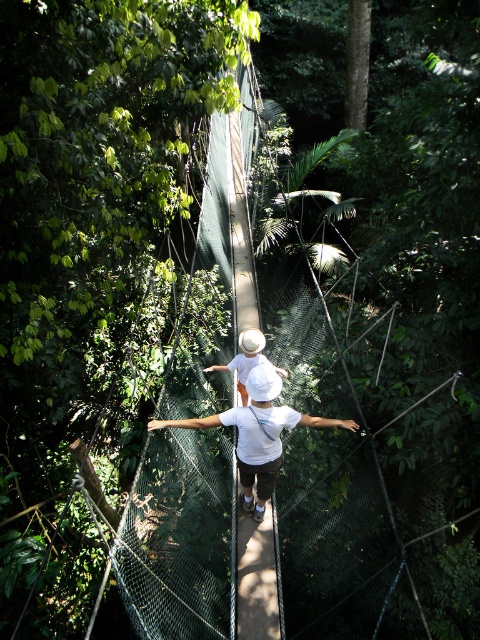
Question: Which point is closer to the camera?

Choices:
 (A) (243, 477)
 (B) (238, 365)

Answer: (A)

Question: Which of the following is the closest to the observer?

Choices:
 (A) white matte hat at center
 (B) white matte shirt at center

Answer: (B)

Question: Is white matte shirt at center further to the viewer compared to white matte hat at center?

Choices:
 (A) yes
 (B) no

Answer: (B)

Question: Does white matte shirt at center appear over white matte hat at center?

Choices:
 (A) yes
 (B) no

Answer: (B)

Question: From the image, what is the correct spatial relationship of white matte shirt at center in relation to white matte hat at center?

Choices:
 (A) right
 (B) left

Answer: (A)

Question: Which of the following is the closest to the observer?

Choices:
 (A) (263, 336)
 (B) (276, 454)

Answer: (B)